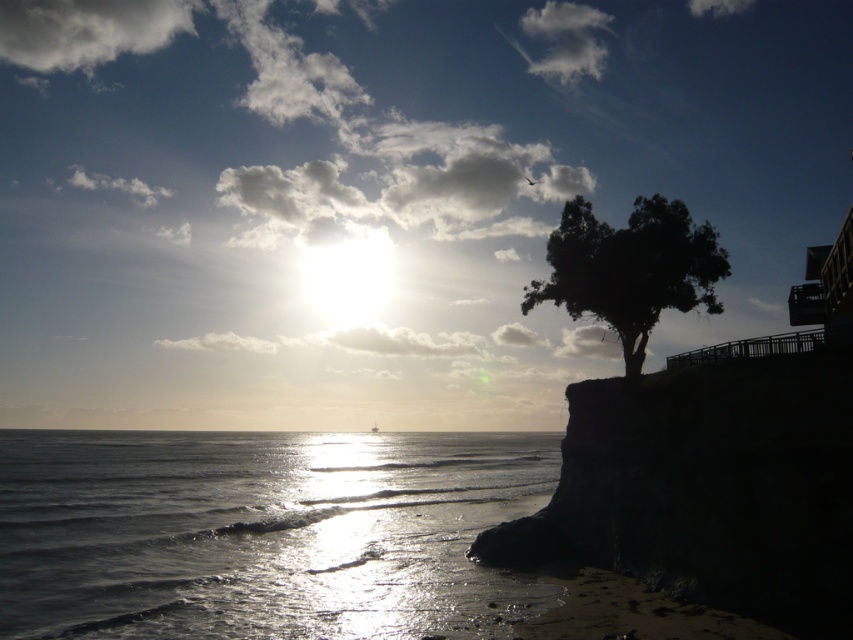
Is point (503, 580) positioned in front of point (642, 292)?

Yes.

Measure the distance between point (48,593) and camera.

A distance of 59.18 feet exists between point (48,593) and camera.

Between point (83, 467) and point (612, 230), which one is positioned in front?

Point (612, 230) is more forward.

The width and height of the screenshot is (853, 640). Find the location of `glistening silver water at lower left`. glistening silver water at lower left is located at coordinates (260, 532).